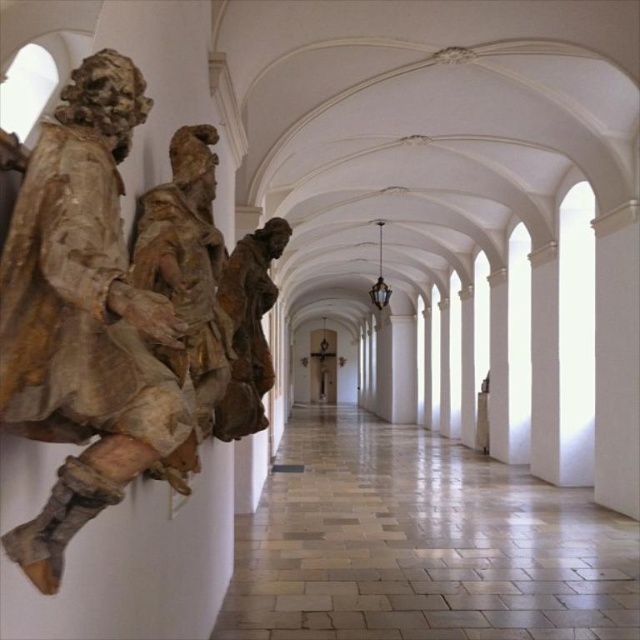
Who is more distant from viewer, (104, 369) or (161, 252)?

Point (161, 252)

I want to click on wooden statue at left, so point(83,317).

Between brown textured statue at center and matte brown statue at center, which one appears on the left side from the viewer's perspective?

brown textured statue at center is more to the left.

Looking at this image, is brown textured statue at center bigger than matte brown statue at center?

No, brown textured statue at center is not bigger than matte brown statue at center.

Who is more distant from viewer, [182,385] or [262,248]?

The point [262,248] is behind.

Locate an element on the screen. This screenshot has height=640, width=640. brown textured statue at center is located at coordinates (186, 284).

Consider the image. Who is taller, wooden statue at left or matte brown statue at center?

matte brown statue at center is taller.

Which of these two, wooden statue at left or matte brown statue at center, stands shorter?

With less height is wooden statue at left.

Does point (161, 401) lie behind point (259, 317)?

No, (161, 401) is closer to viewer.

Where is `wooden statue at left`? The height and width of the screenshot is (640, 640). wooden statue at left is located at coordinates (83, 317).